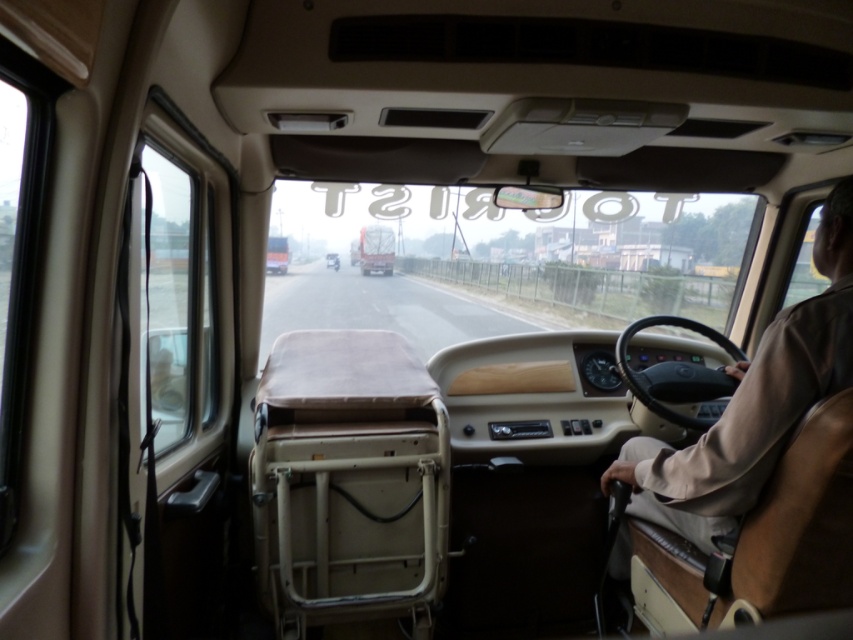
Does beige fabric shirt at right have a greater width compared to metallic silver car at center?

Yes.

Does point (721, 504) come farther from viewer compared to point (334, 266)?

No, (721, 504) is in front of (334, 266).

Which is in front, point (787, 353) or point (334, 266)?

Positioned in front is point (787, 353).

This screenshot has height=640, width=853. Identify the location of beige fabric shirt at right. [x=753, y=403].